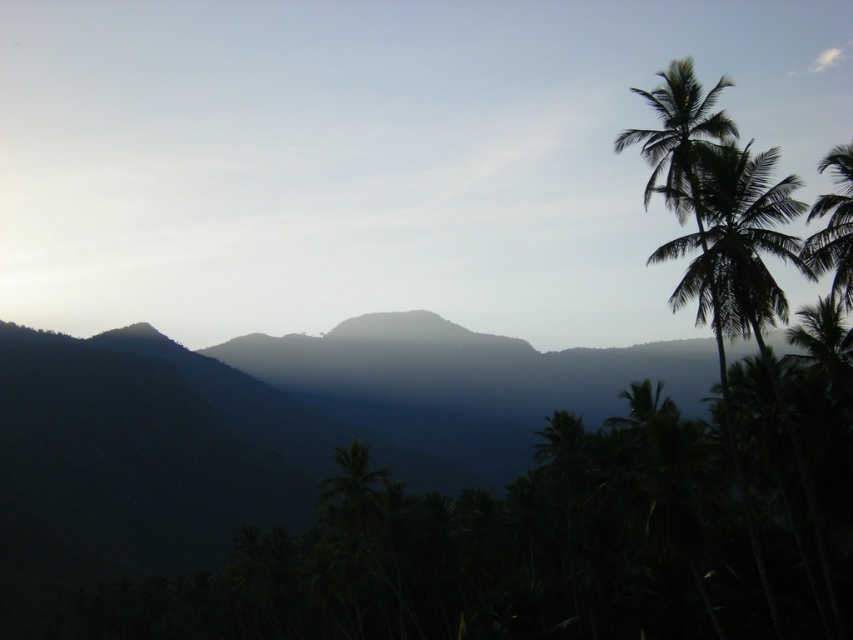
Who is taller, green leafy palm tree at upper right or green leafy palm tree at right?

With more height is green leafy palm tree at upper right.

Can you confirm if green leafy palm tree at upper right is positioned above green leafy palm tree at right?

Yes.

Which is in front, point (682, 205) or point (845, 264)?

Positioned in front is point (845, 264).

You are a GUI agent. You are given a task and a screenshot of the screen. Output one action in this format:
    pyautogui.click(x=<x>, y=<y>)
    Task: Click on the green leafy palm tree at upper right
    This screenshot has width=853, height=640.
    Given the screenshot: What is the action you would take?
    pyautogui.click(x=677, y=132)